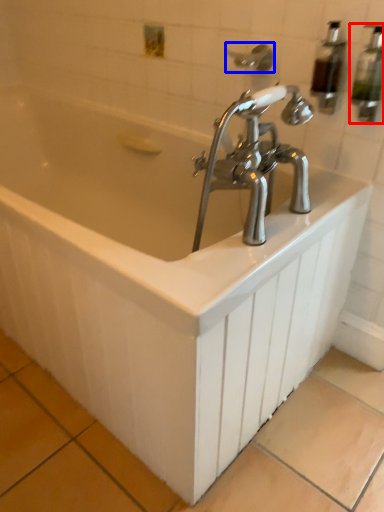
Question: Which of the following is the farthest to the observer, soap dispenser (highlighted by a red box) or shower (highlighted by a blue box)?

Choices:
 (A) soap dispenser
 (B) shower

Answer: (B)